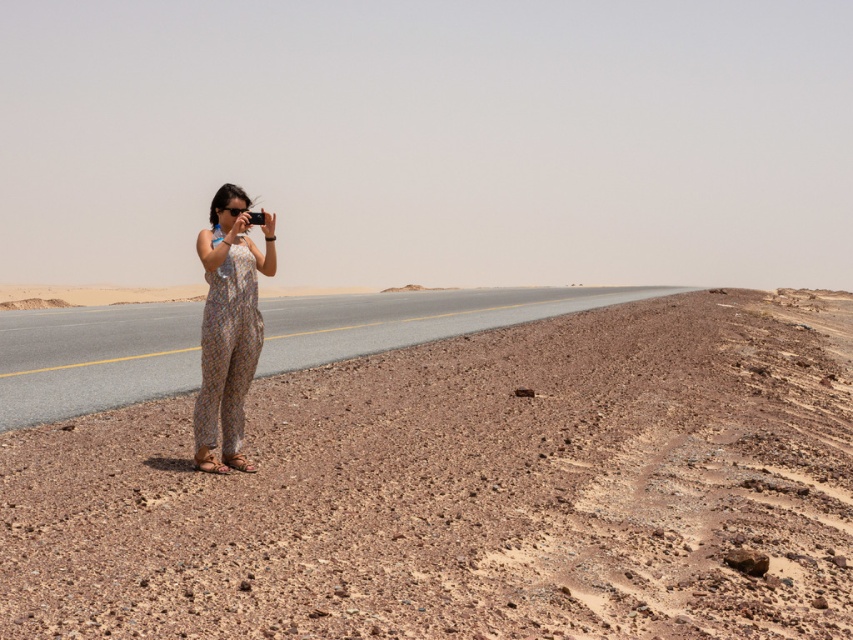
Question: Does brown gravel desert at lower left have a greater width compared to floral-patterned fabric dress at center?

Choices:
 (A) yes
 (B) no

Answer: (A)

Question: Is brown gravel desert at lower left to the left of floral-patterned fabric dress at center from the viewer's perspective?

Choices:
 (A) no
 (B) yes

Answer: (A)

Question: In this image, where is brown gravel desert at lower left located relative to floral-patterned fabric dress at center?

Choices:
 (A) right
 (B) left

Answer: (A)

Question: Among these points, which one is nearest to the camera?

Choices:
 (A) (248, 314)
 (B) (161, 465)

Answer: (A)

Question: Which object appears farthest from the camera in this image?

Choices:
 (A) floral-patterned fabric dress at center
 (B) brown gravel desert at lower left

Answer: (A)